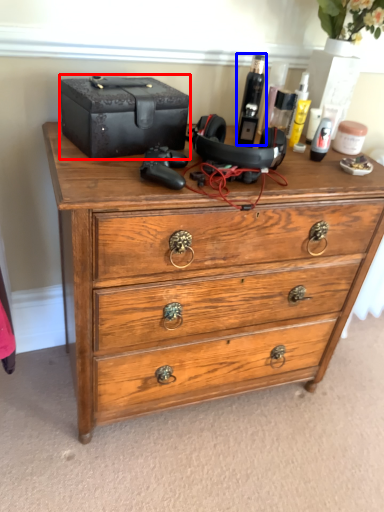
Question: Which of the following is the farthest to the observer, storage box (highlighted by a red box) or toiletry (highlighted by a blue box)?

Choices:
 (A) storage box
 (B) toiletry

Answer: (B)